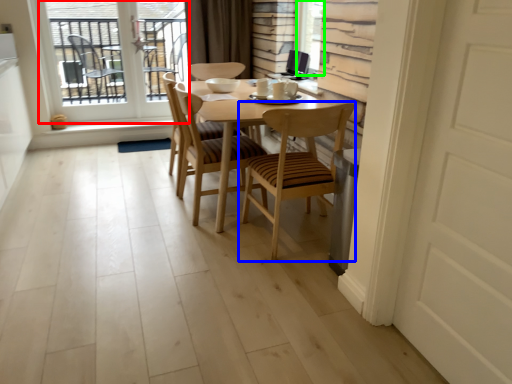
Question: Considering the real-world distances, which object is farthest from window (highlighted by a red box)? chair (highlighted by a blue box) or window screen (highlighted by a green box)?

Choices:
 (A) chair
 (B) window screen

Answer: (A)